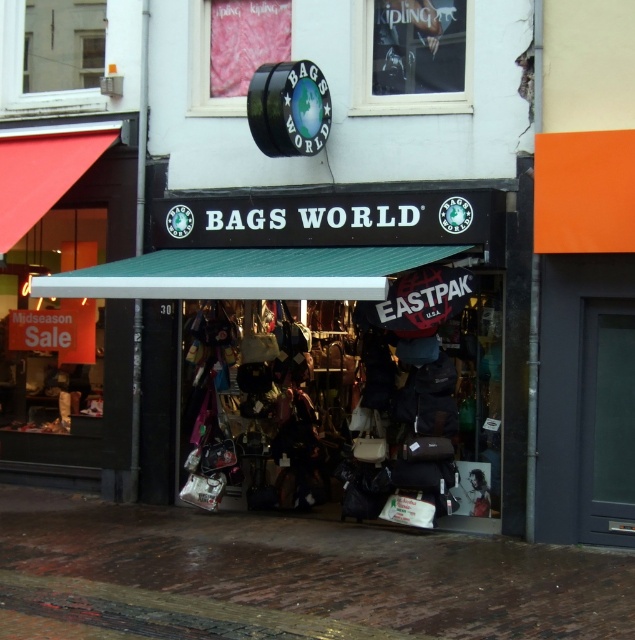
You are standing in front of Bags World and want to walk from the brown brick pavement at lower center to the entrance under the matte black awning at center. Which direction should you move?

You should move to the right because the matte black awning at center is to the right of the brown brick pavement at lower center.

You are a customer standing outside the Bags World store. You notice the matte black awning at center and the brown brick pavement at lower center. Which object is higher from the ground?

The matte black awning at center is much taller than the brown brick pavement at lower center, so the matte black awning at center is higher from the ground.

You are standing outside Bags World and want to take a photo of the storefront. To avoid shadows on the brown brick pavement at lower center, should you position yourself under the matte black awning at center?

The matte black awning at center is positioned over brown brick pavement at lower center, so standing under the awning would cast a shadow on the pavement. To avoid shadows, you should move to a different location not under the awning.